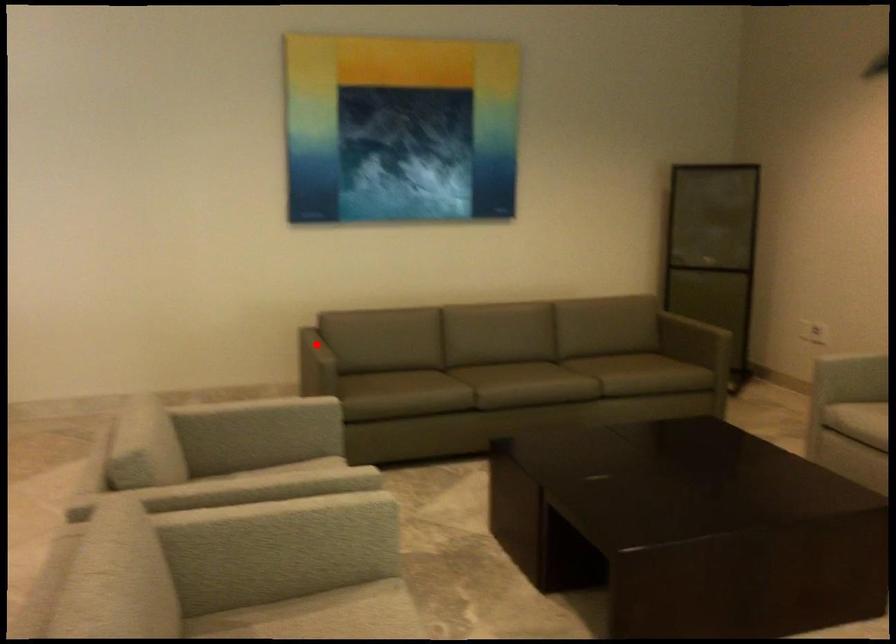
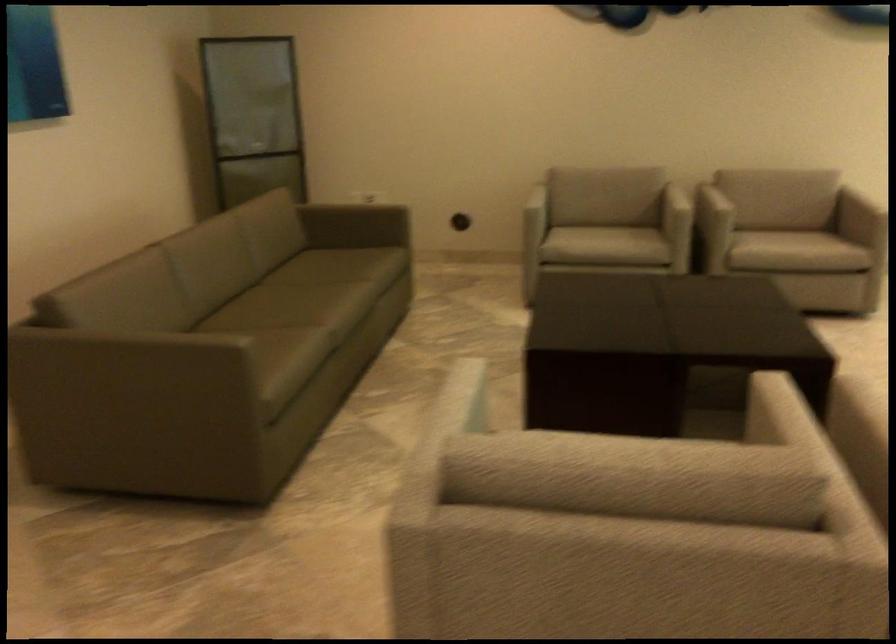
Question: I am providing you with two images of the same scene from different viewpoints. A red point is shown in image1. For the corresponding object point in image2, is it positioned nearer or farther from the camera?

Choices:
 (A) Nearer
 (B) Farther

Answer: (A)